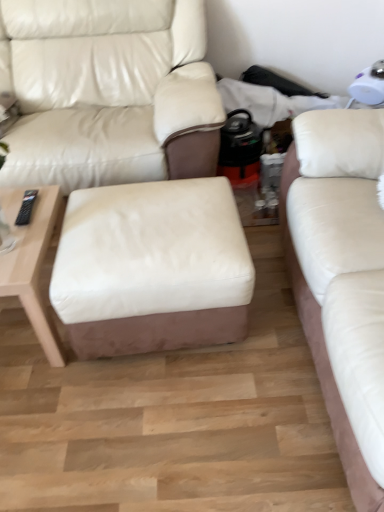
Question: Does point (170, 233) appear closer or farther from the camera than point (56, 194)?

Choices:
 (A) closer
 (B) farther

Answer: (A)

Question: From a real-world perspective, is white leather ottoman at center above or below light wood/woodentable at left?

Choices:
 (A) below
 (B) above

Answer: (B)

Question: Estimate the real-world distances between objects in this image. Which object is closer to the white leather studio couch at right, which is the first studio couch in right-to-left order?

Choices:
 (A) white leather ottoman at center
 (B) light wood/woodentable at left
 (C) white leather studio couch at center, arranged as the 1th studio couch when viewed from the left

Answer: (A)

Question: Which of these objects is positioned farthest from the light wood/woodentable at left?

Choices:
 (A) white leather ottoman at center
 (B) white leather studio couch at right, arranged as the 2th studio couch when viewed from the left
 (C) white leather studio couch at center, arranged as the 1th studio couch when viewed from the left

Answer: (B)